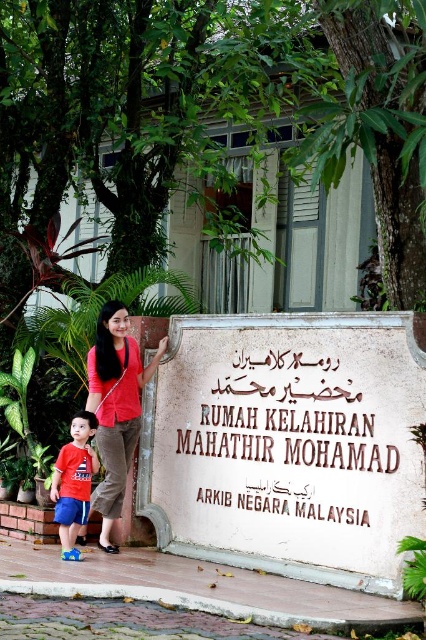
What is located at the coordinates point (288, 444) in the image?

A white stone sign at center is located at point (288, 444).

Looking at this image, you are a tourist visiting the birthplace of Mahathir Mohamad. You see the white stone sign at center and the matte red shirt at center. Which object is positioned to the right of the other?

The white stone sign at center is to the right of the matte red shirt at center.

You are a photographer trying to capture the white stone sign at center and the matte red shirt at center in the same frame. Based on their sizes, do you think both objects will fit in the frame if you adjust your camera angle appropriately?

The white stone sign at center might be wider than matte red shirt at center, so adjusting the camera angle to include the wider white stone sign at center should also accommodate the matte red shirt at center in the frame.